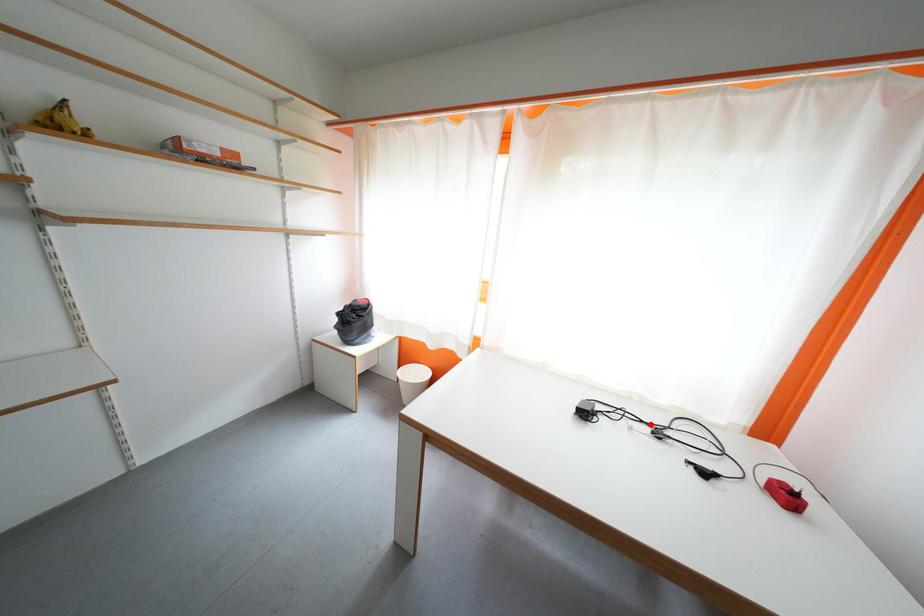
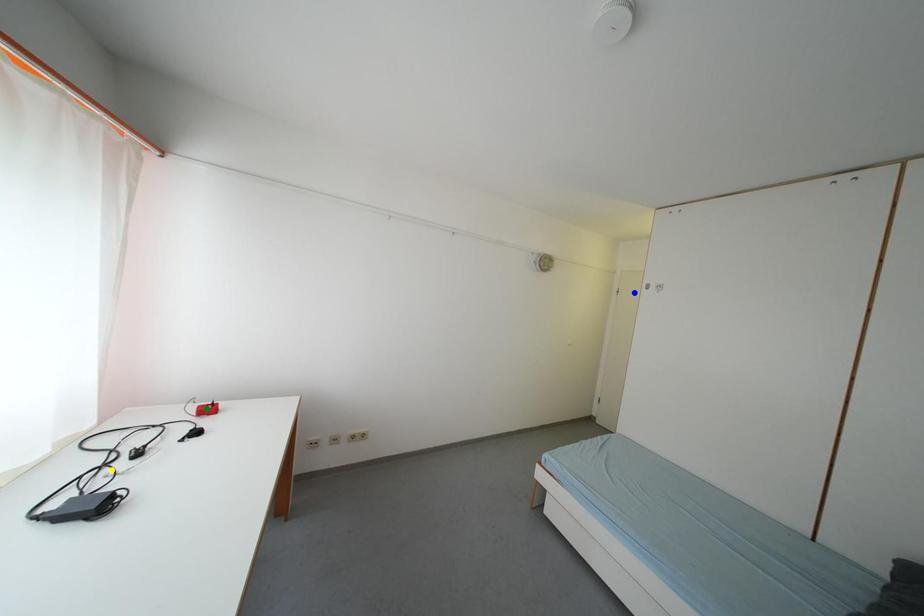
Question: I am providing you with two images of the same scene from different viewpoints. A red point is marked on the first image. You are given multiple points on the second image. Which spot in image 2 lines up with the point in image 1?

Choices:
 (A) blue point
 (B) yellow point
 (C) green point

Answer: (B)